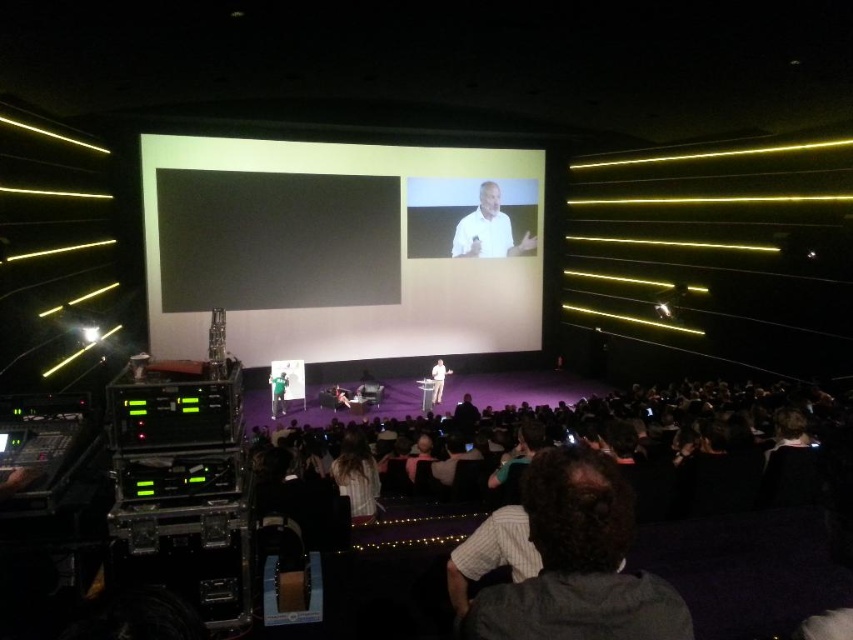
Question: Which object appears farthest from the camera in this image?

Choices:
 (A) white matte shirt at upper center
 (B) dark brown hair at center

Answer: (A)

Question: Which of the following is the closest to the observer?

Choices:
 (A) (567, 596)
 (B) (198, 260)
 (C) (483, 208)

Answer: (A)

Question: Does dark brown hair at center appear over white matte shirt at upper center?

Choices:
 (A) no
 (B) yes

Answer: (A)

Question: Which of these objects is positioned farthest from the white matte shirt at upper center?

Choices:
 (A) dark brown hair at center
 (B) white matte projection screen at center

Answer: (A)

Question: Observing the image, what is the correct spatial positioning of white matte projection screen at center in reference to dark brown hair at center?

Choices:
 (A) left
 (B) right

Answer: (A)

Question: Can you confirm if white matte projection screen at center is thinner than white matte shirt at upper center?

Choices:
 (A) no
 (B) yes

Answer: (A)